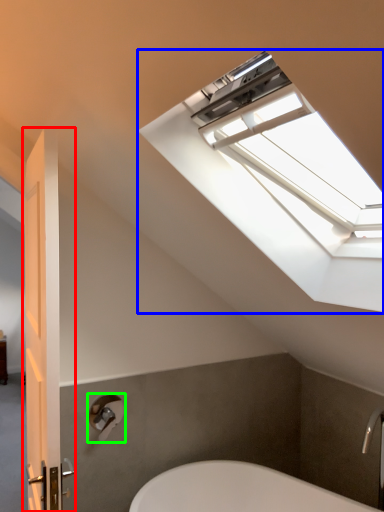
Question: Considering the real-world distances, which object is closest to door (highlighted by a red box)? window (highlighted by a blue box) or shower (highlighted by a green box).

Choices:
 (A) window
 (B) shower

Answer: (A)